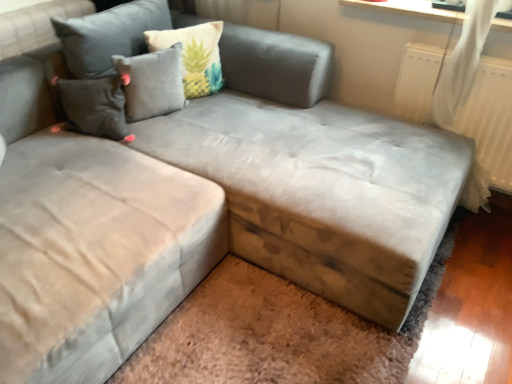
Question: Is gray fabric pillow at upper center, which is the first pillow in left-to-right order, to the right of brown wood storage at lower right from the viewer's perspective?

Choices:
 (A) no
 (B) yes

Answer: (A)

Question: Considering the relative sizes of gray fabric pillow at upper center, which is the 2th pillow from right to left, and brown wood storage at lower right in the image provided, is gray fabric pillow at upper center, which is the 2th pillow from right to left, thinner than brown wood storage at lower right?

Choices:
 (A) yes
 (B) no

Answer: (A)

Question: Is gray fabric pillow at upper center, which is the 2th pillow from right to left, located outside brown wood storage at lower right?

Choices:
 (A) no
 (B) yes

Answer: (B)

Question: Does gray fabric pillow at upper center, which is the first pillow in left-to-right order, come in front of brown wood storage at lower right?

Choices:
 (A) yes
 (B) no

Answer: (B)

Question: Is gray fabric pillow at upper center, which is the 2th pillow from right to left, not close to brown wood storage at lower right?

Choices:
 (A) yes
 (B) no

Answer: (A)

Question: Does gray fabric pillow at upper center, which is the first pillow in left-to-right order, have a larger size compared to brown wood storage at lower right?

Choices:
 (A) no
 (B) yes

Answer: (B)

Question: Considering the relative sizes of beige fabric pillow at upper center, which is counted as the second pillow, starting from the left, and brown wood storage at lower right in the image provided, is beige fabric pillow at upper center, which is counted as the second pillow, starting from the left, shorter than brown wood storage at lower right?

Choices:
 (A) no
 (B) yes

Answer: (A)

Question: Considering the relative sizes of beige fabric pillow at upper center, which is counted as the second pillow, starting from the left, and brown wood storage at lower right in the image provided, is beige fabric pillow at upper center, which is counted as the second pillow, starting from the left, wider than brown wood storage at lower right?

Choices:
 (A) yes
 (B) no

Answer: (B)

Question: Is brown wood storage at lower right a part of beige fabric pillow at upper center, which is counted as the second pillow, starting from the left?

Choices:
 (A) no
 (B) yes

Answer: (A)

Question: Considering the relative sizes of beige fabric pillow at upper center, which is counted as the second pillow, starting from the left, and brown wood storage at lower right in the image provided, is beige fabric pillow at upper center, which is counted as the second pillow, starting from the left, bigger than brown wood storage at lower right?

Choices:
 (A) no
 (B) yes

Answer: (B)

Question: From the image's perspective, does beige fabric pillow at upper center, acting as the 1th pillow starting from the right, appear lower than brown wood storage at lower right?

Choices:
 (A) yes
 (B) no

Answer: (B)

Question: Does beige fabric pillow at upper center, which is counted as the second pillow, starting from the left, appear on the right side of brown wood storage at lower right?

Choices:
 (A) yes
 (B) no

Answer: (B)

Question: Could you tell me if brown wood storage at lower right is turned towards beige fabric pillow at upper center, acting as the 1th pillow starting from the right?

Choices:
 (A) no
 (B) yes

Answer: (A)